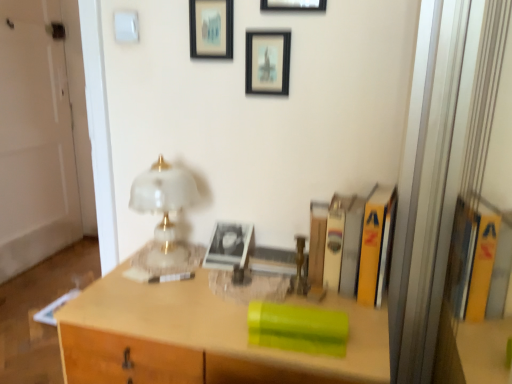
Identify the location of free space that is to the left of green plastic container at center, marked as the 3th book in a right-to-left arrangement. (217, 329).